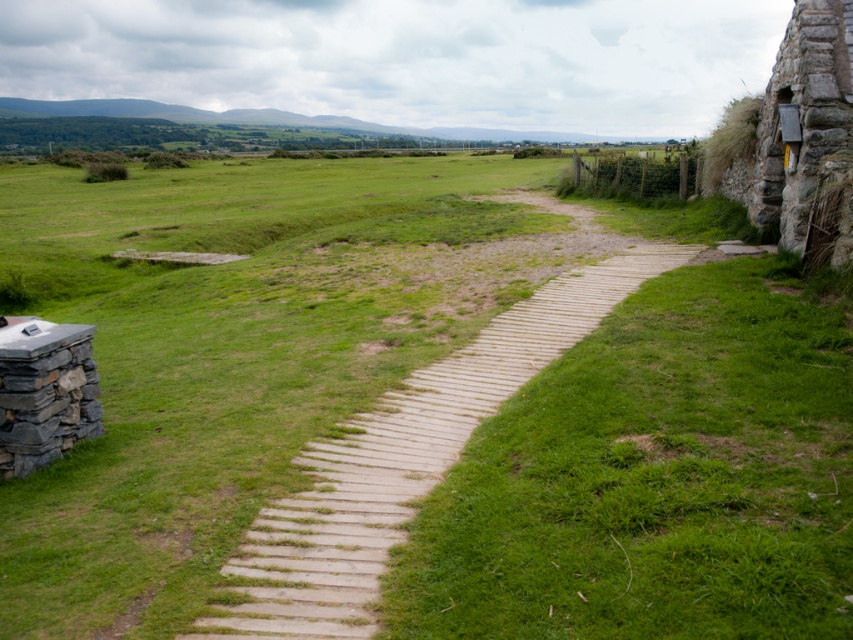
Question: Which object appears farthest from the camera in this image?

Choices:
 (A) gray stone wall at lower left
 (B) green grassy at center
 (C) light brown wooden path at center

Answer: (A)

Question: Which object is farther from the camera taking this photo?

Choices:
 (A) green grassy at center
 (B) light brown wooden path at center

Answer: (B)

Question: Can you confirm if light brown wooden path at center is positioned to the left of gray stone wall at lower left?

Choices:
 (A) no
 (B) yes

Answer: (A)

Question: Which of the following is the closest to the observer?

Choices:
 (A) light brown wooden path at center
 (B) green grassy at center

Answer: (B)

Question: From the image, what is the correct spatial relationship of light brown wooden path at center in relation to gray stone wall at lower left?

Choices:
 (A) right
 (B) left

Answer: (A)

Question: Does green grassy at center appear under light brown wooden path at center?

Choices:
 (A) yes
 (B) no

Answer: (A)